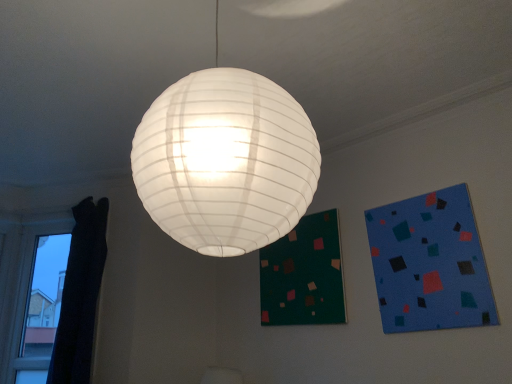
Question: Can blue matte square at upper right be found inside black curtain at left?

Choices:
 (A) yes
 (B) no

Answer: (B)

Question: Are black curtain at left and blue matte square at upper right located far from each other?

Choices:
 (A) no
 (B) yes

Answer: (B)

Question: Is black curtain at left shorter than blue matte square at upper right?

Choices:
 (A) yes
 (B) no

Answer: (B)

Question: Does black curtain at left have a lesser width compared to blue matte square at upper right?

Choices:
 (A) yes
 (B) no

Answer: (B)

Question: Is black curtain at left bigger than blue matte square at upper right?

Choices:
 (A) yes
 (B) no

Answer: (A)

Question: Considering the positions of dark green fabric bulletin board at lower center and black curtain at left in the image, is dark green fabric bulletin board at lower center taller or shorter than black curtain at left?

Choices:
 (A) tall
 (B) short

Answer: (B)

Question: Is dark green fabric bulletin board at lower center bigger or smaller than black curtain at left?

Choices:
 (A) big
 (B) small

Answer: (B)

Question: Is dark green fabric bulletin board at lower center wider or thinner than black curtain at left?

Choices:
 (A) thin
 (B) wide

Answer: (A)

Question: From the image's perspective, is dark green fabric bulletin board at lower center positioned above or below black curtain at left?

Choices:
 (A) below
 (B) above

Answer: (B)

Question: From a real-world perspective, is black curtain at left physically located above or below dark green fabric bulletin board at lower center?

Choices:
 (A) above
 (B) below

Answer: (B)

Question: Relative to dark green fabric bulletin board at lower center, is black curtain at left in front or behind?

Choices:
 (A) behind
 (B) front

Answer: (A)

Question: Is point (57, 299) closer or farther from the camera than point (324, 243)?

Choices:
 (A) closer
 (B) farther

Answer: (B)

Question: In terms of height, does black curtain at left look taller or shorter compared to dark green fabric bulletin board at lower center?

Choices:
 (A) tall
 (B) short

Answer: (A)

Question: Is black curtain at left situated inside blue matte square at upper right or outside?

Choices:
 (A) inside
 (B) outside

Answer: (B)

Question: Based on their positions, is black curtain at left located to the left or right of blue matte square at upper right?

Choices:
 (A) right
 (B) left

Answer: (B)